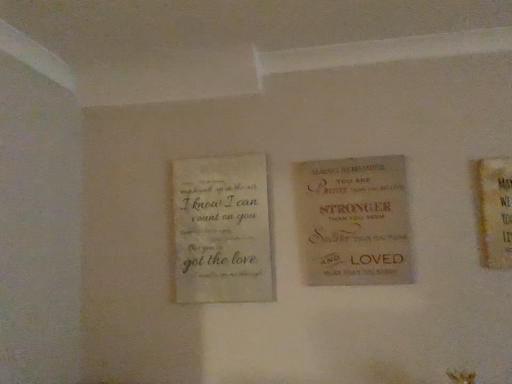
Measure the distance between point (409,223) and camera.

5.46 feet.

The image size is (512, 384). What do you see at coordinates (353, 221) in the screenshot?
I see `beige textured canvas sign at center, placed as the first book when sorted from right to left` at bounding box center [353, 221].

Where is `beige textured canvas sign at center, placed as the first book when sorted from right to left`? The width and height of the screenshot is (512, 384). beige textured canvas sign at center, placed as the first book when sorted from right to left is located at coordinates (353, 221).

How much space does off-white textured paper at left, placed as the 1th book when sorted from left to right, occupy vertically?

It is 25.36 inches.

What do you see at coordinates (222, 230) in the screenshot? I see `off-white textured paper at left, placed as the 1th book when sorted from left to right` at bounding box center [222, 230].

Where is `off-white textured paper at left, placed as the 1th book when sorted from left to right`? Image resolution: width=512 pixels, height=384 pixels. off-white textured paper at left, placed as the 1th book when sorted from left to right is located at coordinates (222, 230).

Identify the location of beige textured canvas sign at center, the second book from the left. The height and width of the screenshot is (384, 512). (353, 221).

Is off-white textured paper at left, placed as the 1th book when sorted from left to right, at the left side of beige textured canvas sign at center, the second book from the left?

Yes, off-white textured paper at left, placed as the 1th book when sorted from left to right, is to the left of beige textured canvas sign at center, the second book from the left.

Relative to beige textured canvas sign at center, the second book from the left, is off-white textured paper at left, the second book positioned from the right, in front or behind?

Clearly, off-white textured paper at left, the second book positioned from the right, is behind beige textured canvas sign at center, the second book from the left.

Is point (212, 222) farther from camera compared to point (394, 160)?

Yes, point (212, 222) is farther from viewer.

From the image's perspective, between off-white textured paper at left, placed as the 1th book when sorted from left to right, and beige textured canvas sign at center, the second book from the left, which one is located above?

beige textured canvas sign at center, the second book from the left, is shown above in the image.

From a real-world perspective, between off-white textured paper at left, the second book positioned from the right, and beige textured canvas sign at center, the second book from the left, who is vertically lower?

In real-world perspective, off-white textured paper at left, the second book positioned from the right, is lower.

Can you confirm if off-white textured paper at left, the second book positioned from the right, is thinner than beige textured canvas sign at center, the second book from the left?

Yes.

Can you confirm if off-white textured paper at left, the second book positioned from the right, is shorter than beige textured canvas sign at center, the second book from the left?

No.

Does off-white textured paper at left, placed as the 1th book when sorted from left to right, have a smaller size compared to beige textured canvas sign at center, the second book from the left?

No, off-white textured paper at left, placed as the 1th book when sorted from left to right, is not smaller than beige textured canvas sign at center, the second book from the left.

Would you say off-white textured paper at left, placed as the 1th book when sorted from left to right, is outside beige textured canvas sign at center, placed as the first book when sorted from right to left?

Yes.

Are off-white textured paper at left, placed as the 1th book when sorted from left to right, and beige textured canvas sign at center, the second book from the left, far apart?

Actually, off-white textured paper at left, placed as the 1th book when sorted from left to right, and beige textured canvas sign at center, the second book from the left, are a little close together.

Is off-white textured paper at left, the second book positioned from the right, aimed at beige textured canvas sign at center, the second book from the left?

No, off-white textured paper at left, the second book positioned from the right, is not oriented towards beige textured canvas sign at center, the second book from the left.

How many degrees apart are the facing directions of off-white textured paper at left, the second book positioned from the right, and beige textured canvas sign at center, placed as the first book when sorted from right to left?

The angle between the facing direction of off-white textured paper at left, the second book positioned from the right, and the facing direction of beige textured canvas sign at center, placed as the first book when sorted from right to left, is 0.372 degrees.

How much distance is there between off-white textured paper at left, placed as the 1th book when sorted from left to right, and beige textured canvas sign at center, placed as the first book when sorted from right to left?

Answer: off-white textured paper at left, placed as the 1th book when sorted from left to right, is 13.14 inches from beige textured canvas sign at center, placed as the first book when sorted from right to left.

The width and height of the screenshot is (512, 384). I want to click on book to the right of off-white textured paper at left, placed as the 1th book when sorted from left to right, so (353, 221).

Considering the relative positions of beige textured canvas sign at center, the second book from the left, and off-white textured paper at left, the second book positioned from the right, in the image provided, is beige textured canvas sign at center, the second book from the left, to the right of off-white textured paper at left, the second book positioned from the right, from the viewer's perspective?

Yes.

Relative to off-white textured paper at left, the second book positioned from the right, is beige textured canvas sign at center, the second book from the left, in front or behind?

Clearly, beige textured canvas sign at center, the second book from the left, is in front of off-white textured paper at left, the second book positioned from the right.

From the picture: Which is closer, [369,182] or [212,258]?

Clearly, point [369,182] is closer to the camera than point [212,258].

From the image's perspective, who appears lower, beige textured canvas sign at center, placed as the first book when sorted from right to left, or off-white textured paper at left, the second book positioned from the right?

off-white textured paper at left, the second book positioned from the right.

From a real-world perspective, does beige textured canvas sign at center, the second book from the left, sit lower than off-white textured paper at left, the second book positioned from the right?

No, from a real-world perspective, beige textured canvas sign at center, the second book from the left, is not under off-white textured paper at left, the second book positioned from the right.

Is beige textured canvas sign at center, placed as the first book when sorted from right to left, wider than off-white textured paper at left, the second book positioned from the right?

Indeed, beige textured canvas sign at center, placed as the first book when sorted from right to left, has a greater width compared to off-white textured paper at left, the second book positioned from the right.

Who is shorter, beige textured canvas sign at center, placed as the first book when sorted from right to left, or off-white textured paper at left, placed as the 1th book when sorted from left to right?

Standing shorter between the two is beige textured canvas sign at center, placed as the first book when sorted from right to left.

Who is smaller, beige textured canvas sign at center, placed as the first book when sorted from right to left, or off-white textured paper at left, placed as the 1th book when sorted from left to right?

beige textured canvas sign at center, placed as the first book when sorted from right to left.

Would you say off-white textured paper at left, placed as the 1th book when sorted from left to right, is part of beige textured canvas sign at center, placed as the first book when sorted from right to left,'s contents?

No.

Consider the image. Is beige textured canvas sign at center, the second book from the left, looking in the opposite direction of off-white textured paper at left, the second book positioned from the right?

No, beige textured canvas sign at center, the second book from the left, is not facing the opposite direction of off-white textured paper at left, the second book positioned from the right.

Find the location of a particular element. This screenshot has width=512, height=384. book above the off-white textured paper at left, placed as the 1th book when sorted from left to right (from the image's perspective) is located at coordinates point(353,221).

Locate an element on the screen. This screenshot has width=512, height=384. book lying below the beige textured canvas sign at center, placed as the first book when sorted from right to left (from the image's perspective) is located at coordinates (222, 230).

The height and width of the screenshot is (384, 512). Find the location of `book on the left side of beige textured canvas sign at center, the second book from the left`. book on the left side of beige textured canvas sign at center, the second book from the left is located at coordinates (222, 230).